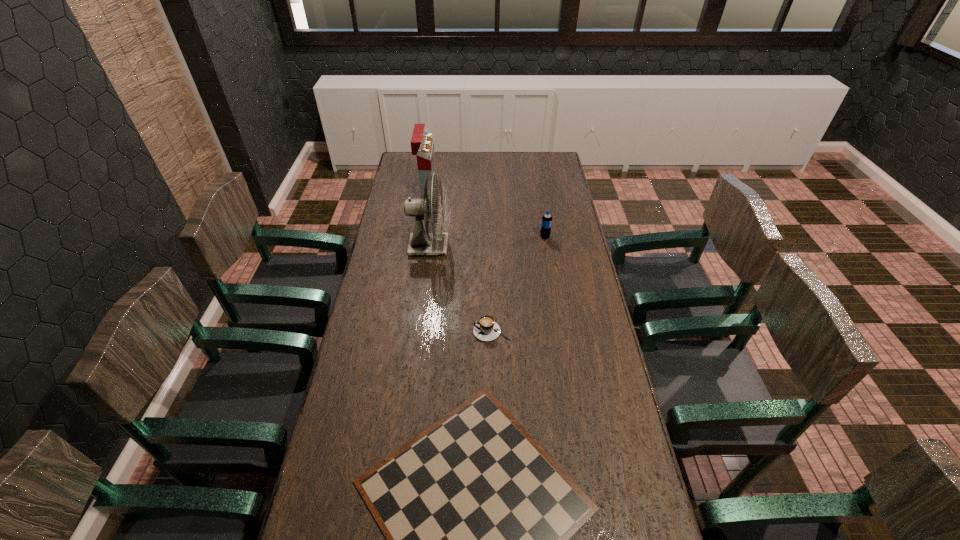
Where is `vacant space located 0.340m with the handle on the side of the cappuccino`? The width and height of the screenshot is (960, 540). vacant space located 0.340m with the handle on the side of the cappuccino is located at coordinates (376, 332).

Identify the location of fan positioned at the left edge. (421, 242).

The width and height of the screenshot is (960, 540). What are the coordinates of `cigarette case that is positioned at the left edge` in the screenshot? It's located at (422, 145).

The image size is (960, 540). In order to click on object at the right edge in this screenshot , I will do [546, 224].

Where is `free space at the far edge`? The height and width of the screenshot is (540, 960). free space at the far edge is located at coordinates (490, 159).

Image resolution: width=960 pixels, height=540 pixels. Find the location of `vacant space at the left edge`. vacant space at the left edge is located at coordinates (372, 306).

Identify the location of vacant space at the right edge of the desktop. (571, 224).

Locate an element on the screen. This screenshot has height=540, width=960. free space at the far right corner of the desktop is located at coordinates (546, 159).

Find the location of `vacant space that's between the cappuccino and the fan`. vacant space that's between the cappuccino and the fan is located at coordinates (460, 289).

The height and width of the screenshot is (540, 960). What are the coordinates of `free space between the cigarette case and the third shortest object` in the screenshot? It's located at pyautogui.click(x=486, y=213).